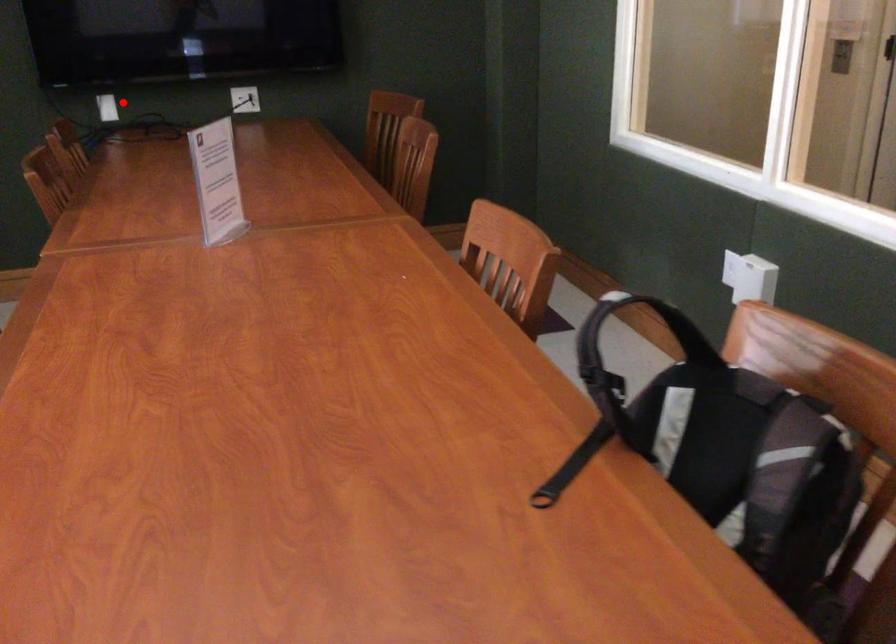
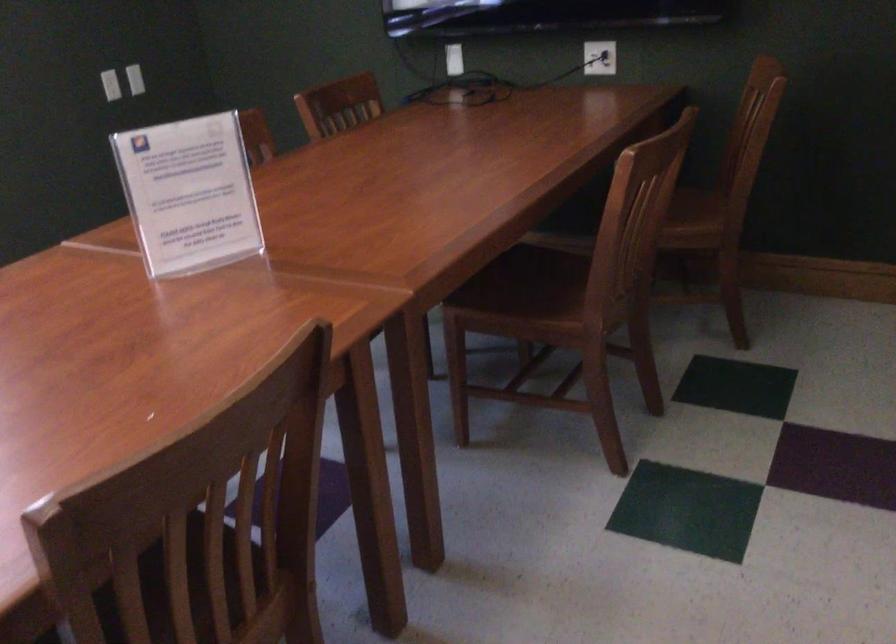
In the second image, find the point that corresponds to the highlighted location in the first image.

(453, 59)